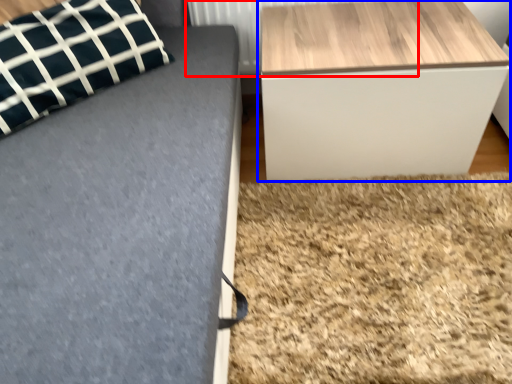
Question: Which point is closer to the camera, radiator (highlighted by a red box) or table (highlighted by a blue box)?

Choices:
 (A) radiator
 (B) table

Answer: (B)